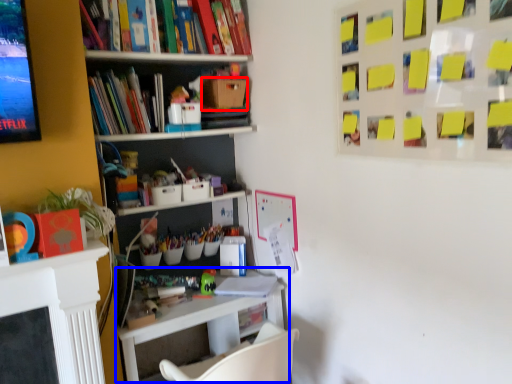
Question: Which of the following is the farthest to the observer, cardboard box (highlighted by a red box) or table (highlighted by a blue box)?

Choices:
 (A) cardboard box
 (B) table

Answer: (A)